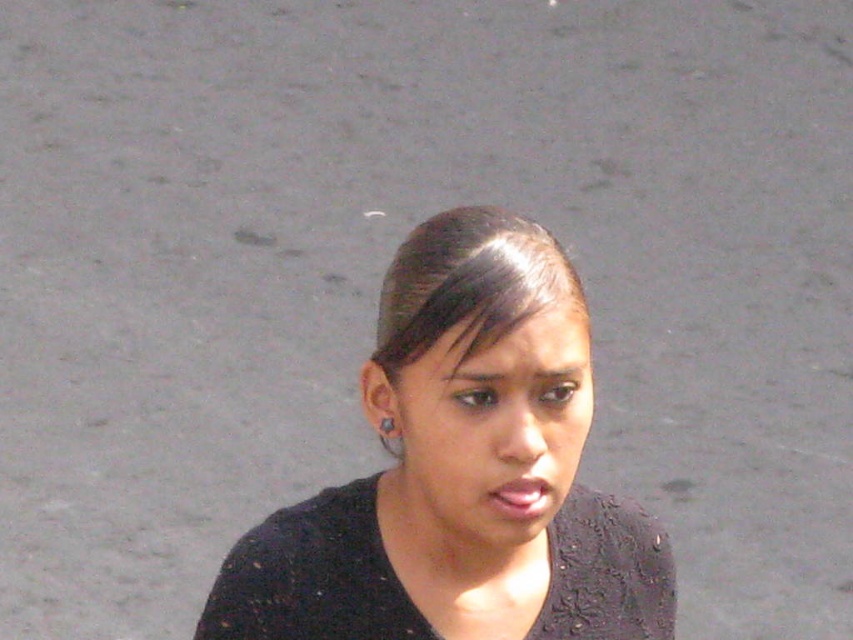
You are an artist trying to recreate this scene. You want to place the black matte shirt at center exactly where it is in the original image. What coordinates should you use for its position?

The black matte shirt at center should be placed at coordinates [462,472] to match its position in the original image.

You are a photographer trying to focus on the subject. Since the black matte shirt at center and the smooth skin face at center are both at the center, which one is closer to the camera?

The black matte shirt at center is in front of the smooth skin face at center, so the black matte shirt at center is closer to the camera.

You are a photographer adjusting lighting for a portrait. You notice the subject has a smooth skin face at center and a silver metallic earring at upper left. Which object is closer to the camera, and why?

The smooth skin face at center is closer to the camera because it is positioned in front of the silver metallic earring at upper left.